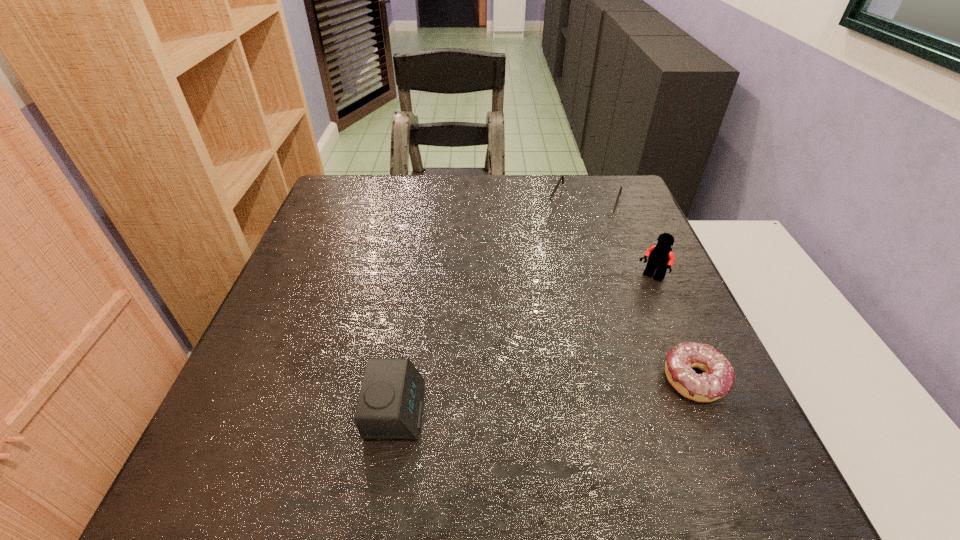
Locate an element on the screen. The height and width of the screenshot is (540, 960). vacant space located 0.120m on the front-facing side of the Lego is located at coordinates (617, 313).

Identify the location of free region located 0.200m at the hinge ends of the farthest object. The height and width of the screenshot is (540, 960). (557, 273).

You are a GUI agent. You are given a task and a screenshot of the screen. Output one action in this format:
    pyautogui.click(x=<x>, y=<y>)
    Task: Click on the vacant space located at the hinge ends of the farthest object
    The height and width of the screenshot is (540, 960).
    Given the screenshot: What is the action you would take?
    550,289

Locate an element on the screen. The height and width of the screenshot is (540, 960). vacant space positioned 0.050m at the hinge ends of the farthest object is located at coordinates (571, 238).

You are a GUI agent. You are given a task and a screenshot of the screen. Output one action in this format:
    pyautogui.click(x=<x>, y=<y>)
    Task: Click on the object situated at the far edge
    The height and width of the screenshot is (540, 960).
    Given the screenshot: What is the action you would take?
    pyautogui.click(x=595, y=215)

Identify the location of alarm clock positioned at the near edge. The height and width of the screenshot is (540, 960). (390, 404).

You are a GUI agent. You are given a task and a screenshot of the screen. Output one action in this format:
    pyautogui.click(x=<x>, y=<y>)
    Task: Click on the doughnut at the near edge
    
    Given the screenshot: What is the action you would take?
    pyautogui.click(x=718, y=379)

Locate an element on the screen. This screenshot has width=960, height=540. doughnut positioned at the right edge is located at coordinates (718, 379).

Image resolution: width=960 pixels, height=540 pixels. In order to click on Lego located at the right edge in this screenshot , I will do `click(660, 257)`.

The height and width of the screenshot is (540, 960). I want to click on spectacles at the right edge, so click(x=595, y=215).